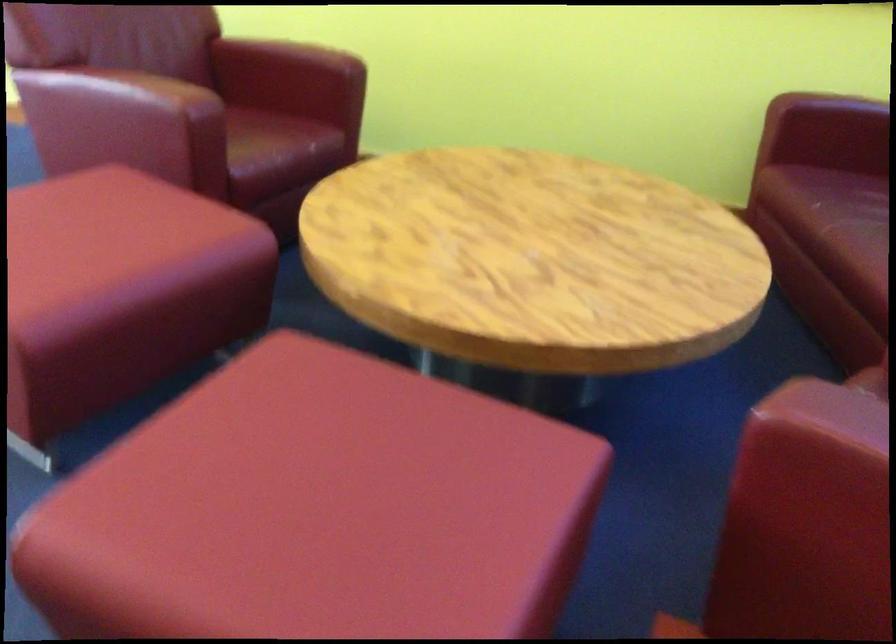
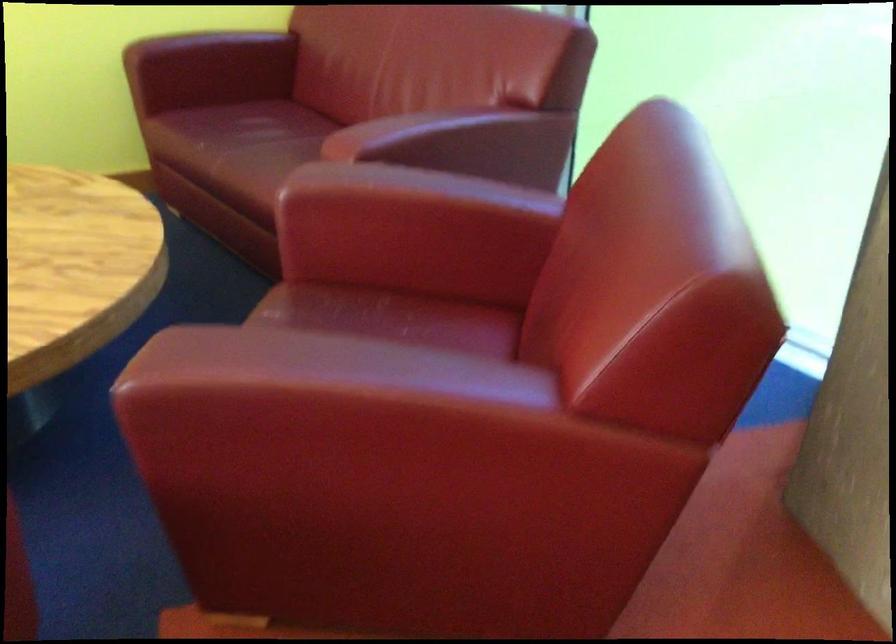
Question: Based on the continuous images, in which direction is the camera rotating? Reply with the corresponding letter.

Choices:
 (A) Left
 (B) Right
 (C) Up
 (D) Down

Answer: (B)